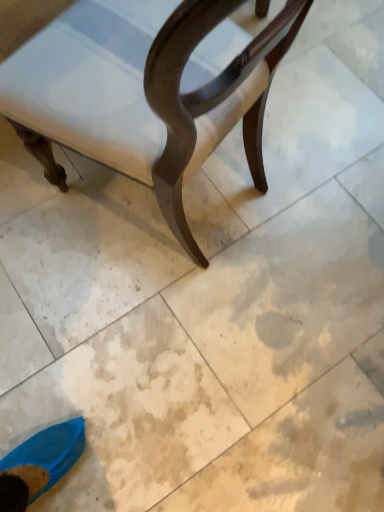
The height and width of the screenshot is (512, 384). What are the coordinates of `free location in front of glossy wood chair at upper center` in the screenshot? It's located at (129, 340).